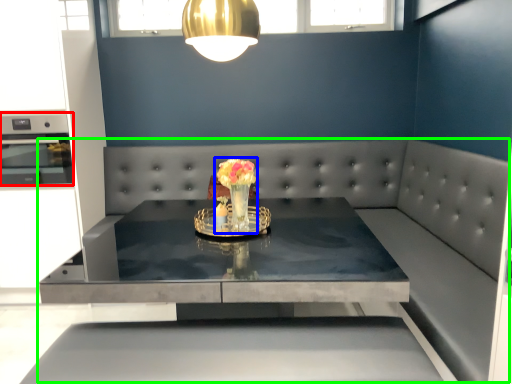
Question: Which is farther away from appliance (highlighted by a red box)? floral arrangement (highlighted by a blue box) or couch (highlighted by a green box)?

Choices:
 (A) floral arrangement
 (B) couch

Answer: (A)